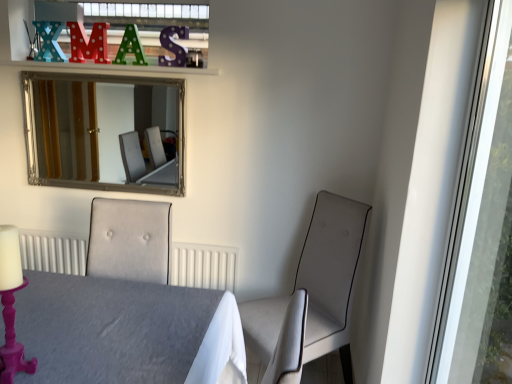
Question: Would you say transparent glass window at right is part of green polka dot letter a at upper center, the third alphabet in the left-to-right sequence,'s contents?

Choices:
 (A) no
 (B) yes

Answer: (A)

Question: Considering the relative sizes of green polka dot letter a at upper center, which appears as the 1th alphabet when viewed from the right, and transparent glass window at right in the image provided, is green polka dot letter a at upper center, which appears as the 1th alphabet when viewed from the right, taller than transparent glass window at right?

Choices:
 (A) yes
 (B) no

Answer: (B)

Question: Considering the relative positions of green polka dot letter a at upper center, which appears as the 1th alphabet when viewed from the right, and transparent glass window at right in the image provided, is green polka dot letter a at upper center, which appears as the 1th alphabet when viewed from the right, to the right of transparent glass window at right from the viewer's perspective?

Choices:
 (A) yes
 (B) no

Answer: (B)

Question: From a real-world perspective, is green polka dot letter a at upper center, the third alphabet in the left-to-right sequence, over transparent glass window at right?

Choices:
 (A) yes
 (B) no

Answer: (A)

Question: Is green polka dot letter a at upper center, the third alphabet in the left-to-right sequence, smaller than transparent glass window at right?

Choices:
 (A) no
 (B) yes

Answer: (B)

Question: Considering their positions, is suede-like beige chair at right located in front of or behind green polka dot letter a at upper center, which appears as the 1th alphabet when viewed from the right?

Choices:
 (A) behind
 (B) front

Answer: (B)

Question: In terms of size, does suede-like beige chair at right appear bigger or smaller than green polka dot letter a at upper center, which appears as the 1th alphabet when viewed from the right?

Choices:
 (A) big
 (B) small

Answer: (A)

Question: Based on their positions, is suede-like beige chair at right located to the left or right of green polka dot letter a at upper center, the third alphabet in the left-to-right sequence?

Choices:
 (A) left
 (B) right

Answer: (B)

Question: From the image's perspective, relative to green polka dot letter a at upper center, the third alphabet in the left-to-right sequence, is suede-like beige chair at right above or below?

Choices:
 (A) above
 (B) below

Answer: (B)

Question: Is green polka dot letter a at upper center, which appears as the 1th alphabet when viewed from the right, inside or outside of silver/glass mirror at upper left?

Choices:
 (A) outside
 (B) inside

Answer: (A)

Question: Does point (129, 41) appear closer or farther from the camera than point (172, 175)?

Choices:
 (A) farther
 (B) closer

Answer: (B)

Question: In terms of size, does green polka dot letter a at upper center, which appears as the 1th alphabet when viewed from the right, appear bigger or smaller than silver/glass mirror at upper left?

Choices:
 (A) small
 (B) big

Answer: (A)

Question: Is green polka dot letter a at upper center, the third alphabet in the left-to-right sequence, in front of or behind silver/glass mirror at upper left in the image?

Choices:
 (A) behind
 (B) front

Answer: (A)

Question: From a real-world perspective, is green polka dot letter a at upper center, the third alphabet in the left-to-right sequence, physically located above or below teal felt letter x at upper left, placed as the first alphabet when sorted from left to right?

Choices:
 (A) above
 (B) below

Answer: (B)

Question: Considering the positions of green polka dot letter a at upper center, which appears as the 1th alphabet when viewed from the right, and teal felt letter x at upper left, which is the 3th alphabet from right to left, in the image, is green polka dot letter a at upper center, which appears as the 1th alphabet when viewed from the right, bigger or smaller than teal felt letter x at upper left, which is the 3th alphabet from right to left,?

Choices:
 (A) small
 (B) big

Answer: (B)